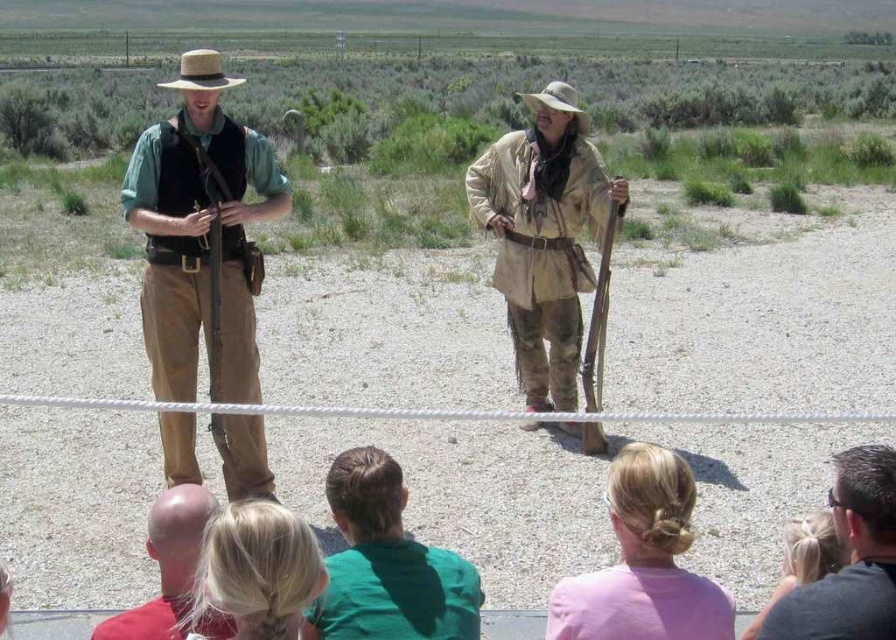
Which is behind, point (819, 538) or point (556, 108)?

The point (556, 108) is more distant.

Is point (811, 548) more distant than point (547, 90)?

No.

Which is in front, point (802, 529) or point (550, 90)?

Point (802, 529) is more forward.

Identify the location of blonde hair at upper center. This screenshot has height=640, width=896. (803, 557).

Can you confirm if dirt field at center is positioned below matte green shirt at center?

No.

Is point (448, 509) positioned after point (174, 316)?

Yes, point (448, 509) is behind point (174, 316).

Which is in front, point (653, 392) or point (171, 461)?

Point (171, 461) is in front.

Where is `dirt field at center`? The width and height of the screenshot is (896, 640). dirt field at center is located at coordinates (760, 316).

Does matte green shirt at center have a lesser height compared to brown straw cowboy hat at upper left?

Yes.

How far apart are matte green shirt at center and brown straw cowboy hat at upper left?

A distance of 29.68 feet exists between matte green shirt at center and brown straw cowboy hat at upper left.

Between point (185, 364) and point (188, 54), which one is positioned in front?

Positioned in front is point (188, 54).

The height and width of the screenshot is (640, 896). Identify the location of matte green shirt at center. (201, 236).